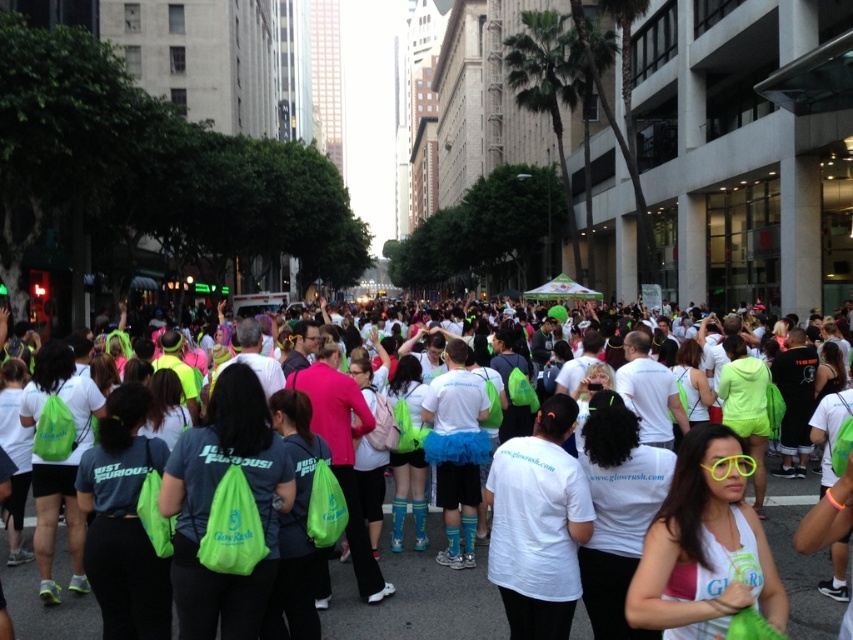
Question: Considering the relative positions of green fabric bag at center and neon yellow plastic sunglasses at center in the image provided, where is green fabric bag at center located with respect to neon yellow plastic sunglasses at center?

Choices:
 (A) below
 (B) above

Answer: (A)

Question: From the image, what is the correct spatial relationship of green fabric bag at center in relation to neon yellow plastic sunglasses at center?

Choices:
 (A) left
 (B) right

Answer: (A)

Question: Which point appears farthest from the camera in this image?

Choices:
 (A) (798, 556)
 (B) (688, 609)

Answer: (A)

Question: Which point appears closest to the camera in this image?

Choices:
 (A) (434, 573)
 (B) (708, 589)

Answer: (B)

Question: Among these points, which one is farthest from the camera?

Choices:
 (A) (735, 492)
 (B) (462, 621)

Answer: (B)

Question: Is green fabric bag at center further to the viewer compared to neon yellow plastic sunglasses at center?

Choices:
 (A) no
 (B) yes

Answer: (B)